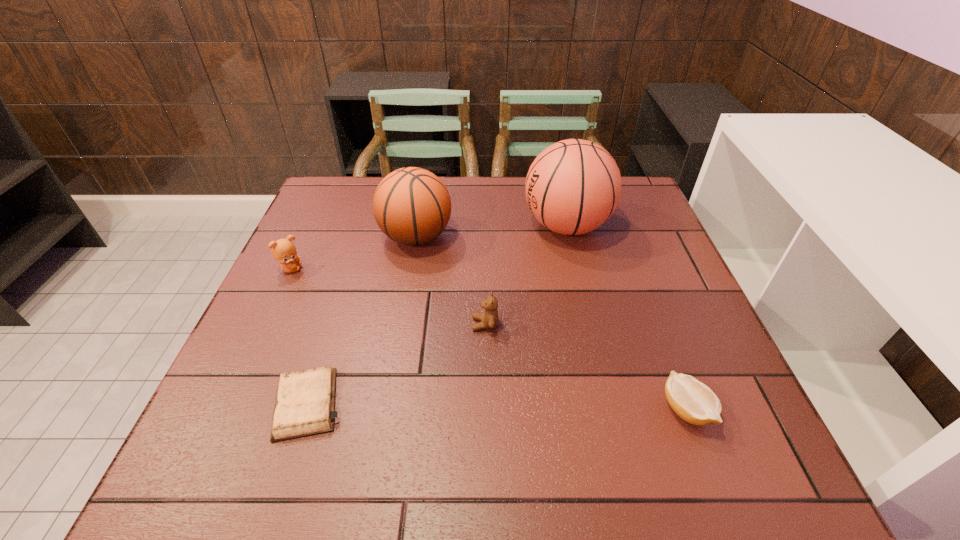
Identify the location of free space located 0.370m on the surface of the right basketball near the brand logo. The width and height of the screenshot is (960, 540). (390, 226).

Image resolution: width=960 pixels, height=540 pixels. I want to click on free space located 0.290m on the surface of the right basketball near the brand logo, so click(419, 226).

Where is `vacant region located on the surface of the right basketball near the brand logo`? vacant region located on the surface of the right basketball near the brand logo is located at coordinates (476, 226).

Where is `vacant space located 0.110m on the right of the left basketball`? The image size is (960, 540). vacant space located 0.110m on the right of the left basketball is located at coordinates (493, 237).

Where is `vacant space situated 0.060m on the face of the leftmost object`? vacant space situated 0.060m on the face of the leftmost object is located at coordinates (326, 269).

Where is `vacant region located 0.150m on the front-facing side of the third nearest object`? The height and width of the screenshot is (540, 960). vacant region located 0.150m on the front-facing side of the third nearest object is located at coordinates (403, 324).

Where is `blank space located 0.070m on the front-facing side of the third nearest object`? This screenshot has width=960, height=540. blank space located 0.070m on the front-facing side of the third nearest object is located at coordinates (440, 324).

Where is `vacant space located on the front-facing side of the third nearest object`? The image size is (960, 540). vacant space located on the front-facing side of the third nearest object is located at coordinates tap(440, 324).

You are a GUI agent. You are given a task and a screenshot of the screen. Output one action in this format:
    pyautogui.click(x=<x>, y=<y>)
    Task: Click on the vacant space situated 0.270m on the back of the lemon
    The width and height of the screenshot is (960, 540).
    Given the screenshot: What is the action you would take?
    pyautogui.click(x=640, y=287)

At what (x,y) coordinates should I click in order to perform the action: click on vacant area located on the right of the shortest object. Please return your answer as a coordinate pair (x, y). This screenshot has width=960, height=540. Looking at the image, I should click on (477, 404).